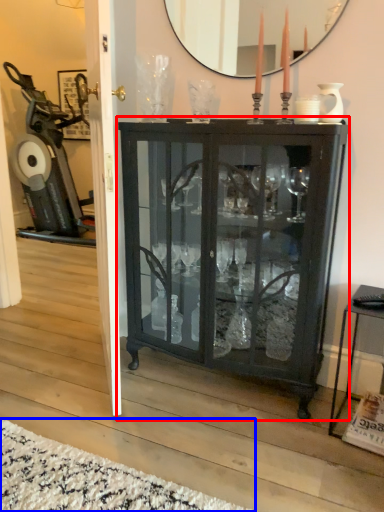
Question: Among these objects, which one is farthest to the camera, cupboard (highlighted by a red box) or plain (highlighted by a blue box)?

Choices:
 (A) cupboard
 (B) plain

Answer: (A)